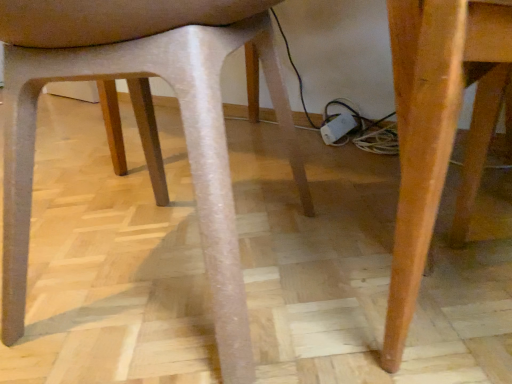
Where is `matte plastic chair at center`? matte plastic chair at center is located at coordinates (143, 123).

This screenshot has height=384, width=512. Describe the element at coordinates (143, 123) in the screenshot. I see `matte plastic chair at center` at that location.

This screenshot has height=384, width=512. What are the coordinates of `matte plastic chair at center` in the screenshot? It's located at click(x=143, y=123).